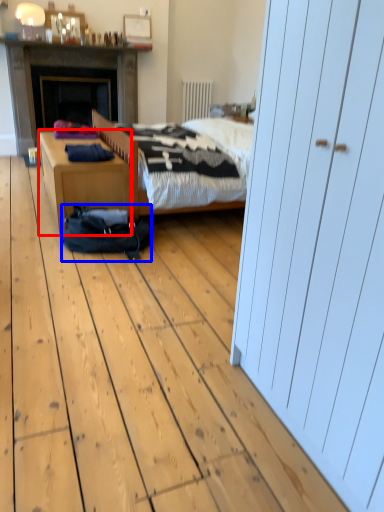
Question: Which point is closer to the camera, desk (highlighted by a red box) or sleeping bag (highlighted by a blue box)?

Choices:
 (A) desk
 (B) sleeping bag

Answer: (B)